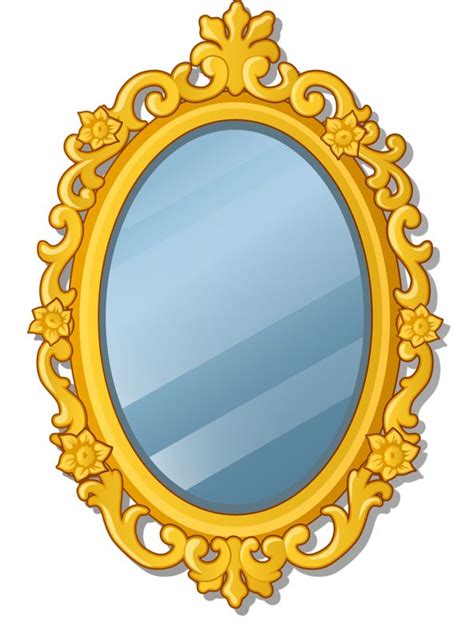
At what (x,y) coordinates should I click in order to perform the action: click on mirror. Please return your answer as a coordinate pair (x, y). The width and height of the screenshot is (474, 639). Looking at the image, I should click on (244, 473).